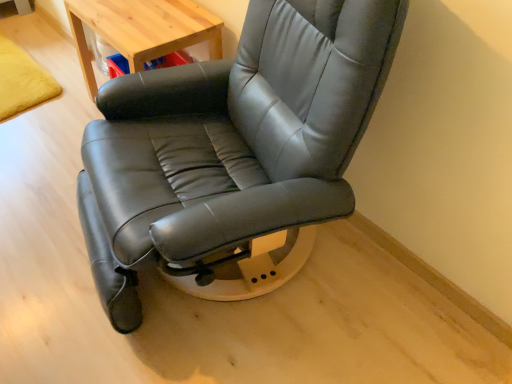
Locate an element on the screen. Image resolution: width=512 pixels, height=384 pixels. free region on the left part of light wood table at upper left is located at coordinates (39, 118).